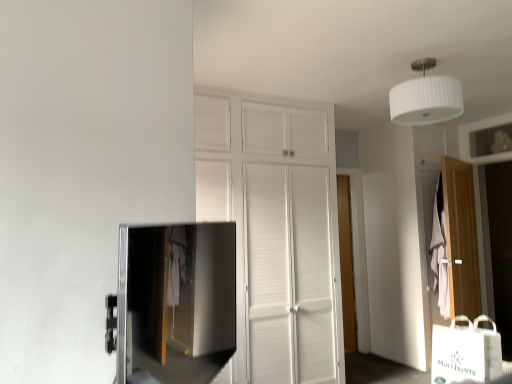
Question: Is the position of wooden door at right, the 2th door from the left, less distant than that of white paper bag at lower right?

Choices:
 (A) no
 (B) yes

Answer: (A)

Question: From a real-world perspective, is wooden door at right, the 2th door when ordered from back to front, beneath white paper bag at lower right?

Choices:
 (A) yes
 (B) no

Answer: (B)

Question: Is wooden door at right, positioned as the first door in right-to-left order, beside white paper bag at lower right?

Choices:
 (A) no
 (B) yes

Answer: (A)

Question: Is wooden door at right, the 2th door from the left, outside white paper bag at lower right?

Choices:
 (A) no
 (B) yes

Answer: (B)

Question: Is wooden door at right, which appears as the 1th door when viewed from the front, smaller than white paper bag at lower right?

Choices:
 (A) yes
 (B) no

Answer: (B)

Question: Could you tell me if wooden door at right, the 2th door from the left, is turned towards white paper bag at lower right?

Choices:
 (A) yes
 (B) no

Answer: (B)

Question: Is satin black tv at lower left surrounding wooden door at center, the 2th door viewed from the right?

Choices:
 (A) yes
 (B) no

Answer: (B)

Question: From a real-world perspective, is satin black tv at lower left on top of wooden door at center, the 2th door viewed from the right?

Choices:
 (A) no
 (B) yes

Answer: (B)

Question: Is satin black tv at lower left further to camera compared to wooden door at center, the 2th door viewed from the right?

Choices:
 (A) no
 (B) yes

Answer: (A)

Question: Is satin black tv at lower left far from wooden door at center, which is counted as the first door, starting from the back?

Choices:
 (A) yes
 (B) no

Answer: (A)

Question: Is satin black tv at lower left thinner than wooden door at center, the 2th door viewed from the right?

Choices:
 (A) no
 (B) yes

Answer: (B)

Question: Can you confirm if satin black tv at lower left is positioned to the right of wooden door at center, the second door when ordered from front to back?

Choices:
 (A) yes
 (B) no

Answer: (B)

Question: Considering the relative sizes of white ribbed shade at upper center and white paper bag at lower right in the image provided, is white ribbed shade at upper center smaller than white paper bag at lower right?

Choices:
 (A) no
 (B) yes

Answer: (A)